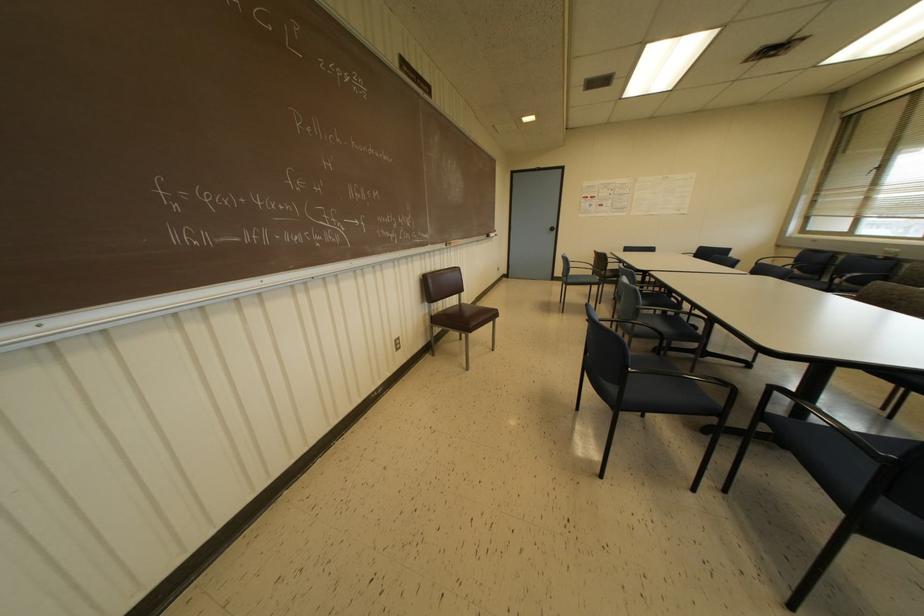
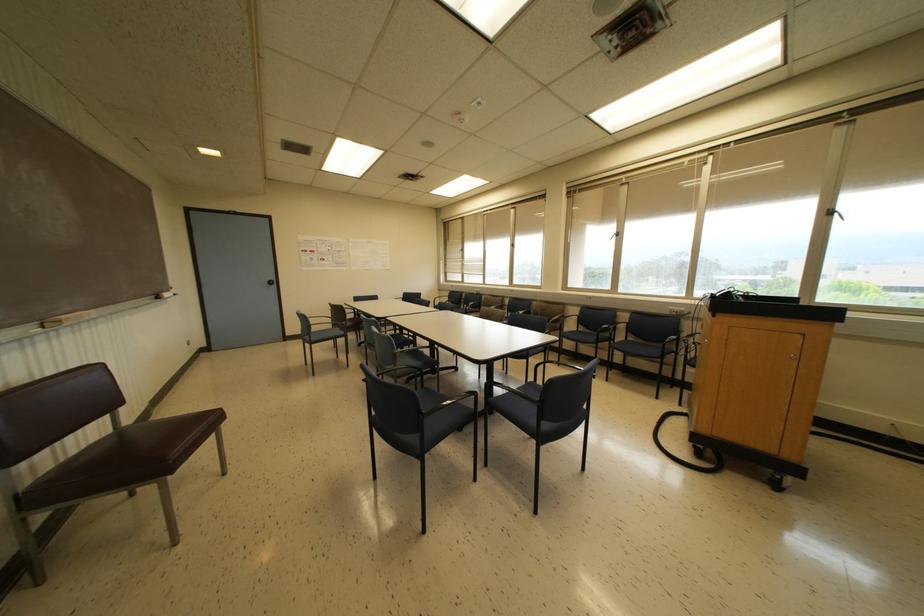
Question: The first image is from the beginning of the video and the second image is from the end. How did the camera likely rotate when shooting the video?

Choices:
 (A) Left
 (B) Right
 (C) Up
 (D) Down

Answer: (B)